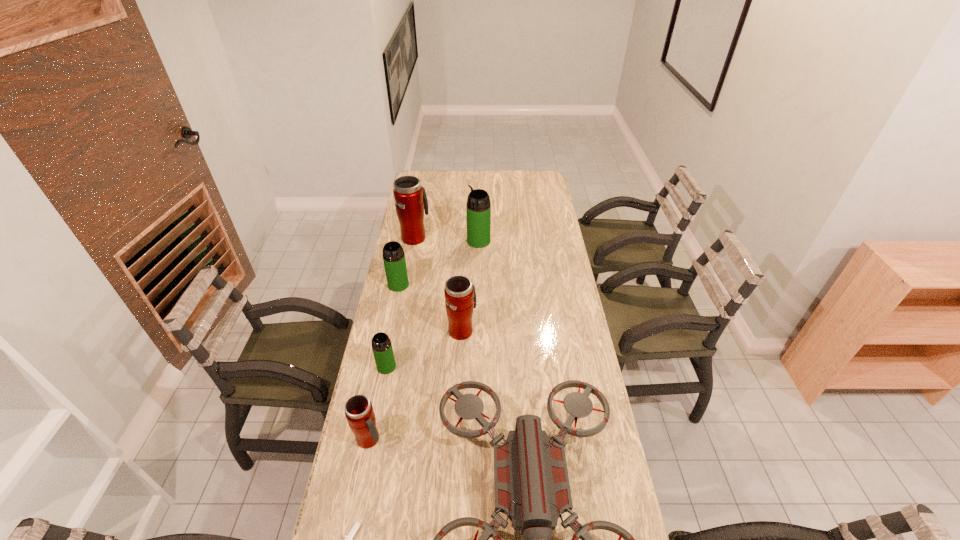
Image resolution: width=960 pixels, height=540 pixels. I want to click on free space between the sixth nearest object and the biggest green thermos bottle, so click(439, 263).

Identify the location of the closest object relative to the farthest red thermos bottle. The height and width of the screenshot is (540, 960). (478, 208).

Select which object appears as the sixth closest to the nearest thermos bottle. Please provide its 2D coordinates. Your answer should be formatted as a tuple, i.e. [(x, y)], where the tuple contains the x and y coordinates of a point satisfying the conditions above.

[(410, 197)]

Choose which thermos bottle is the second nearest neighbor to the second nearest green thermos bottle. Please provide its 2D coordinates. Your answer should be formatted as a tuple, i.e. [(x, y)], where the tuple contains the x and y coordinates of a point satisfying the conditions above.

[(460, 296)]

Find the location of a particular element. the fourth closest thermos bottle to the smallest red thermos bottle is located at coordinates 410,197.

Identify which green thermos bottle is the second nearest to the farthest green thermos bottle. Please provide its 2D coordinates. Your answer should be formatted as a tuple, i.e. [(x, y)], where the tuple contains the x and y coordinates of a point satisfying the conditions above.

[(382, 349)]

I want to click on green thermos bottle that is the closest to the second farthest green thermos bottle, so click(478, 208).

Locate which red thermos bottle ranks third in proximity to the third farthest object. Please provide its 2D coordinates. Your answer should be formatted as a tuple, i.e. [(x, y)], where the tuple contains the x and y coordinates of a point satisfying the conditions above.

[(359, 412)]

Select which red thermos bottle appears as the second closest to the rightmost green thermos bottle. Please provide its 2D coordinates. Your answer should be formatted as a tuple, i.e. [(x, y)], where the tuple contains the x and y coordinates of a point satisfying the conditions above.

[(460, 296)]

This screenshot has height=540, width=960. I want to click on free location that satisfies the following two spatial constraints: 1. from the spout of the biggest green thermos bottle; 2. from the spout of the second farthest green thermos bottle, so click(478, 285).